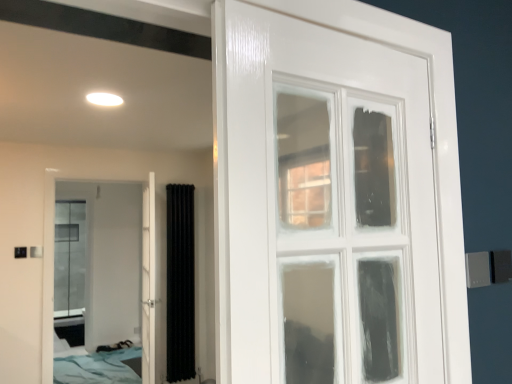
Describe the element at coordinates (112, 268) in the screenshot. I see `white glossy door at left, which is the 2th door from right to left` at that location.

Where is `blue fabric bed at lower left`? Image resolution: width=512 pixels, height=384 pixels. blue fabric bed at lower left is located at coordinates 95,366.

Looking at this image, is white glossy door at left, which is the 2th door from right to left, next to blue fabric bed at lower left and touching it?

There is a gap between white glossy door at left, which is the 2th door from right to left, and blue fabric bed at lower left.

Is white glossy door at left, which is the 2th door from right to left, completely or partially outside of blue fabric bed at lower left?

Yes, white glossy door at left, which is the 2th door from right to left, is located beyond the bounds of blue fabric bed at lower left.

Is white glossy door at left, the first door in the left-to-right sequence, closer to the viewer compared to blue fabric bed at lower left?

Yes, white glossy door at left, the first door in the left-to-right sequence, is in front of blue fabric bed at lower left.

How different are the orientations of white glossy door at left, which is the 2th door from right to left, and blue fabric bed at lower left in degrees?

0.192 degrees separate the facing orientations of white glossy door at left, which is the 2th door from right to left, and blue fabric bed at lower left.

Is there a large distance between white glossy door at center, the 2th door from the left, and black textured curtain at center?

No, white glossy door at center, the 2th door from the left, is in close proximity to black textured curtain at center.

Which is correct: white glossy door at center, the first door positioned from the right, is inside black textured curtain at center, or outside of it?

The correct answer is: outside.

Who is smaller, white glossy door at center, the 2th door from the left, or black textured curtain at center?

Smaller between the two is black textured curtain at center.

From a real-world perspective, between white glossy door at center, the 2th door from the left, and black textured curtain at center, who is vertically lower?

black textured curtain at center, from a real-world perspective.

Considering the relative sizes of white glossy door at center, the 2th door from the left, and blue fabric bed at lower left in the image provided, is white glossy door at center, the 2th door from the left, thinner than blue fabric bed at lower left?

Correct, the width of white glossy door at center, the 2th door from the left, is less than that of blue fabric bed at lower left.

Is white glossy door at center, the first door positioned from the right, located outside blue fabric bed at lower left?

white glossy door at center, the first door positioned from the right, is positioned outside blue fabric bed at lower left.

Between white glossy door at center, the 2th door from the left, and blue fabric bed at lower left, which one has larger size?

Bigger between the two is blue fabric bed at lower left.

Considering the positions of objects white glossy door at center, the 2th door from the left, and blue fabric bed at lower left in the image provided, who is more to the left, white glossy door at center, the 2th door from the left, or blue fabric bed at lower left?

blue fabric bed at lower left.

Does white glossy door at left, the first door in the left-to-right sequence, have a lesser width compared to white glossy door at center, the first door positioned from the right?

Yes, white glossy door at left, the first door in the left-to-right sequence, is thinner than white glossy door at center, the first door positioned from the right.

Can you confirm if white glossy door at left, the first door in the left-to-right sequence, is taller than white glossy door at center, the first door positioned from the right?

Yes.

Can you confirm if white glossy door at left, the first door in the left-to-right sequence, is bigger than white glossy door at center, the first door positioned from the right?

No, white glossy door at left, the first door in the left-to-right sequence, is not bigger than white glossy door at center, the first door positioned from the right.

From the picture: Which point is more forward, (42,352) or (154,268)?

The point (42,352) is closer to the camera.

In terms of size, does blue fabric bed at lower left appear bigger or smaller than white glossy door at left, which is the 2th door from right to left?

blue fabric bed at lower left is bigger than white glossy door at left, which is the 2th door from right to left.

What's the angular difference between blue fabric bed at lower left and white glossy door at left, which is the 2th door from right to left,'s facing directions?

The angle between the facing direction of blue fabric bed at lower left and the facing direction of white glossy door at left, which is the 2th door from right to left, is 0.192 degrees.

Would you say blue fabric bed at lower left is outside white glossy door at left, the first door in the left-to-right sequence?

Indeed, blue fabric bed at lower left is completely outside white glossy door at left, the first door in the left-to-right sequence.

Considering the relative positions of blue fabric bed at lower left and white glossy door at left, the first door in the left-to-right sequence, in the image provided, is blue fabric bed at lower left behind white glossy door at left, the first door in the left-to-right sequence,?

Yes.

Do you think black textured curtain at center is within blue fabric bed at lower left, or outside of it?

The correct answer is: outside.

From the image's perspective, would you say black textured curtain at center is shown under blue fabric bed at lower left?

No, from the image's perspective, black textured curtain at center is not beneath blue fabric bed at lower left.

Is point (169, 334) closer to camera compared to point (85, 356)?

Yes.

In the image, there is a white glossy door at center, the 2th door from the left. Identify the location of curtain below it (from a real-world perspective). This screenshot has width=512, height=384. (180, 283).

From a real-world perspective, which object rests below the other?

In real-world perspective, black textured curtain at center is lower.

Considering the sizes of objects black textured curtain at center and white glossy door at center, the 2th door from the left, in the image provided, who is thinner, black textured curtain at center or white glossy door at center, the 2th door from the left,?

black textured curtain at center.

Does black textured curtain at center have a larger size compared to white glossy door at center, the first door positioned from the right?

Actually, black textured curtain at center might be smaller than white glossy door at center, the first door positioned from the right.

Locate an element on the screen. The height and width of the screenshot is (384, 512). bed that appears on the left of white glossy door at left, which is the 2th door from right to left is located at coordinates (95, 366).

This screenshot has width=512, height=384. I want to click on curtain behind the white glossy door at center, the 2th door from the left, so click(x=180, y=283).

Looking at the image, which one is located further to black textured curtain at center, blue fabric bed at lower left or white glossy door at left, the first door in the left-to-right sequence?

Based on the image, white glossy door at left, the first door in the left-to-right sequence, appears to be further to black textured curtain at center.

From the image, which object appears to be nearer to black textured curtain at center, white glossy door at left, the first door in the left-to-right sequence, or blue fabric bed at lower left?

The object closer to black textured curtain at center is blue fabric bed at lower left.

Looking at the image, which one is located closer to black textured curtain at center, white glossy door at center, the first door positioned from the right, or white glossy door at left, which is the 2th door from right to left?

white glossy door at center, the first door positioned from the right, is closer to black textured curtain at center.

Looking at the image, which one is located further to white glossy door at left, the first door in the left-to-right sequence, black textured curtain at center or white glossy door at center, the 2th door from the left?

white glossy door at center, the 2th door from the left, is further to white glossy door at left, the first door in the left-to-right sequence.

Which object lies further to the anchor point white glossy door at center, the 2th door from the left, black textured curtain at center or blue fabric bed at lower left?

blue fabric bed at lower left is further to white glossy door at center, the 2th door from the left.

Which object lies further to the anchor point blue fabric bed at lower left, white glossy door at center, the 2th door from the left, or black textured curtain at center?

Based on the image, white glossy door at center, the 2th door from the left, appears to be further to blue fabric bed at lower left.

Considering their positions, is white glossy door at left, the first door in the left-to-right sequence, positioned further to blue fabric bed at lower left than black textured curtain at center?

Based on the image, black textured curtain at center appears to be further to blue fabric bed at lower left.

Based on their spatial positions, is blue fabric bed at lower left or black textured curtain at center further from white glossy door at left, the first door in the left-to-right sequence?

black textured curtain at center is positioned further to the anchor white glossy door at left, the first door in the left-to-right sequence.

You are a GUI agent. You are given a task and a screenshot of the screen. Output one action in this format:
    pyautogui.click(x=<x>, y=<y>)
    Task: Click on the door between white glossy door at left, which is the 2th door from right to left, and blue fabric bed at lower left from top to bottom
    The height and width of the screenshot is (384, 512).
    Given the screenshot: What is the action you would take?
    pyautogui.click(x=148, y=280)

Locate an element on the screen. The image size is (512, 384). curtain that lies between white glossy door at left, which is the 2th door from right to left, and blue fabric bed at lower left from top to bottom is located at coordinates (180, 283).

I want to click on door between white glossy door at center, the first door positioned from the right, and black textured curtain at center in the front-back direction, so click(x=112, y=268).

Locate an element on the screen. The height and width of the screenshot is (384, 512). curtain between white glossy door at center, the 2th door from the left, and blue fabric bed at lower left vertically is located at coordinates (180, 283).